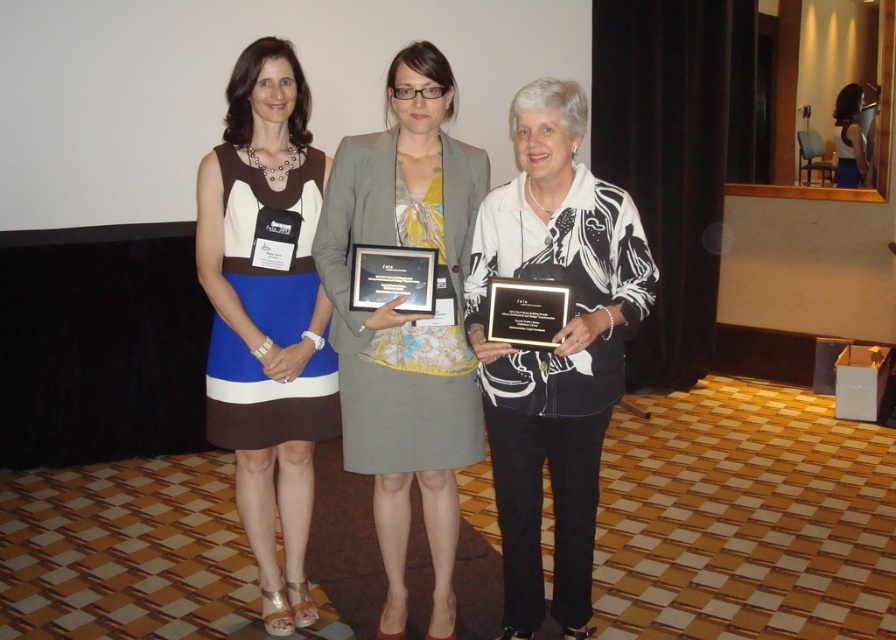
Question: Which point is farther to the camera?

Choices:
 (A) matte gray skirt at center
 (B) blue fabric dress at left
 (C) white printed fabric at center

Answer: (B)

Question: Which of these objects is positioned closest to the matte gray skirt at center?

Choices:
 (A) blue fabric dress at left
 (B) white printed fabric at center

Answer: (B)

Question: Does matte gray skirt at center have a smaller size compared to blue fabric dress at left?

Choices:
 (A) no
 (B) yes

Answer: (A)

Question: Considering the relative positions of white printed fabric at center and blue fabric dress at left in the image provided, where is white printed fabric at center located with respect to blue fabric dress at left?

Choices:
 (A) right
 (B) left

Answer: (A)

Question: Can you confirm if matte gray skirt at center is positioned below blue fabric dress at left?

Choices:
 (A) no
 (B) yes

Answer: (B)

Question: Considering the real-world distances, which object is closest to the matte gray skirt at center?

Choices:
 (A) blue fabric dress at left
 (B) white printed fabric at center

Answer: (B)